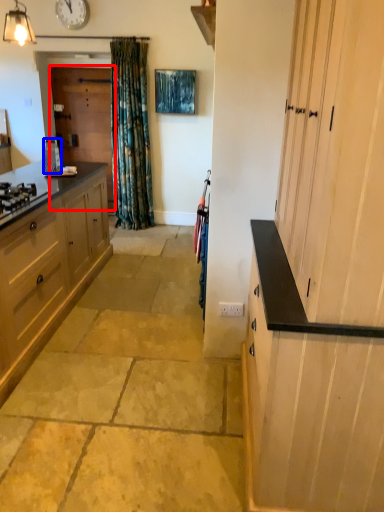
Question: Which object is further to the camera taking this photo, screen door (highlighted by a red box) or appliance (highlighted by a blue box)?

Choices:
 (A) screen door
 (B) appliance

Answer: (A)